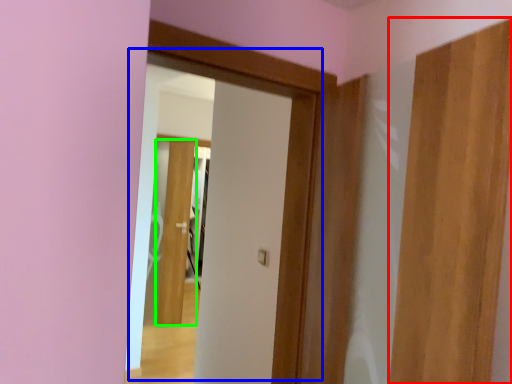
Question: Which object is positioned closest to door (highlighted by a red box)? Select from door (highlighted by a blue box) and door (highlighted by a green box).

Choices:
 (A) door
 (B) door

Answer: (A)